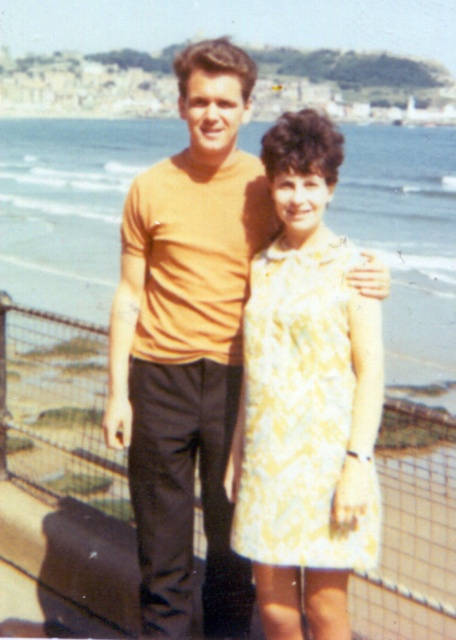
You are a photographer trying to capture a photo of the metal wire fence at center and the yellow floral dress at center. According to the scene, which object is located to the left of the other?

The metal wire fence at center is positioned on the left side of yellow floral dress at center.

You are a photographer trying to capture a photo of the yellow floral dress at center and the metal wire fence at center. If your camera can only focus on objects within 10 feet, will both subjects be in focus?

The distance between the metal wire fence at center and the yellow floral dress at center is 15.67 feet, which exceeds the camera focus range of 10 feet. Therefore, both subjects cannot be in focus simultaneously.